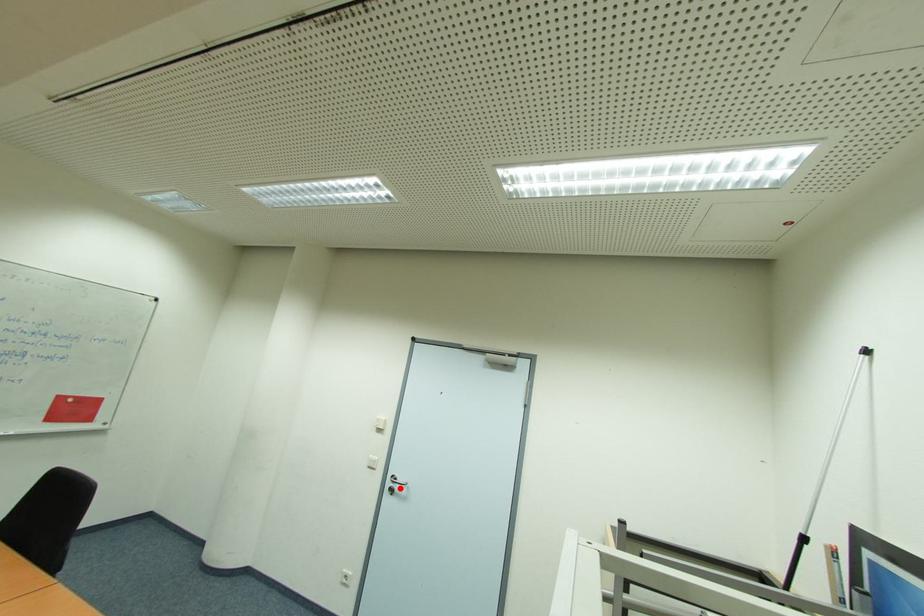
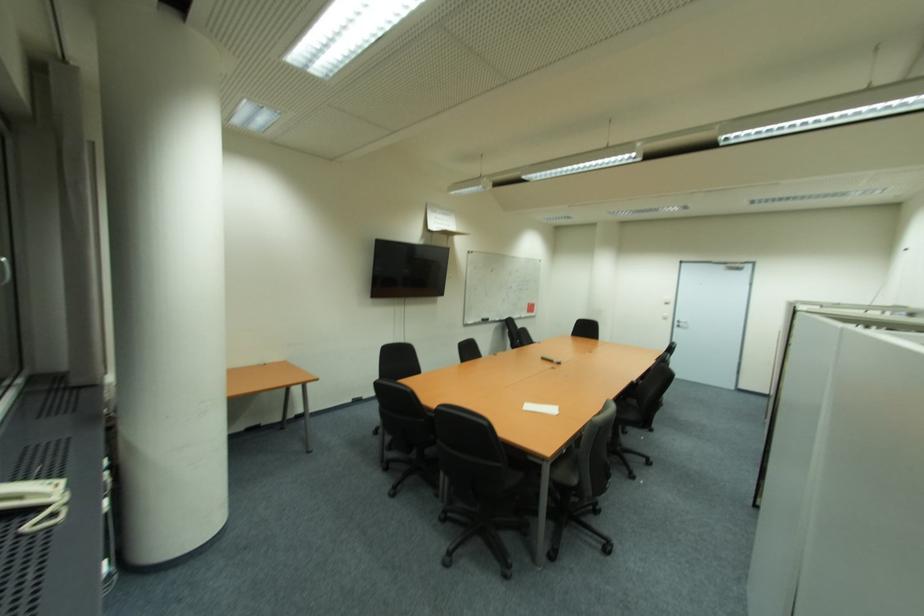
Where in the second image is the point corresponding to the highlighted location from the first image?

(686, 325)